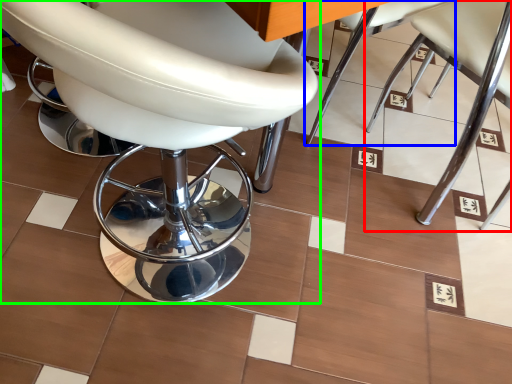
Question: Based on their relative distances, which object is nearer to chair (highlighted by a red box)? Choose from chair (highlighted by a blue box) and chair (highlighted by a green box).

Choices:
 (A) chair
 (B) chair

Answer: (A)